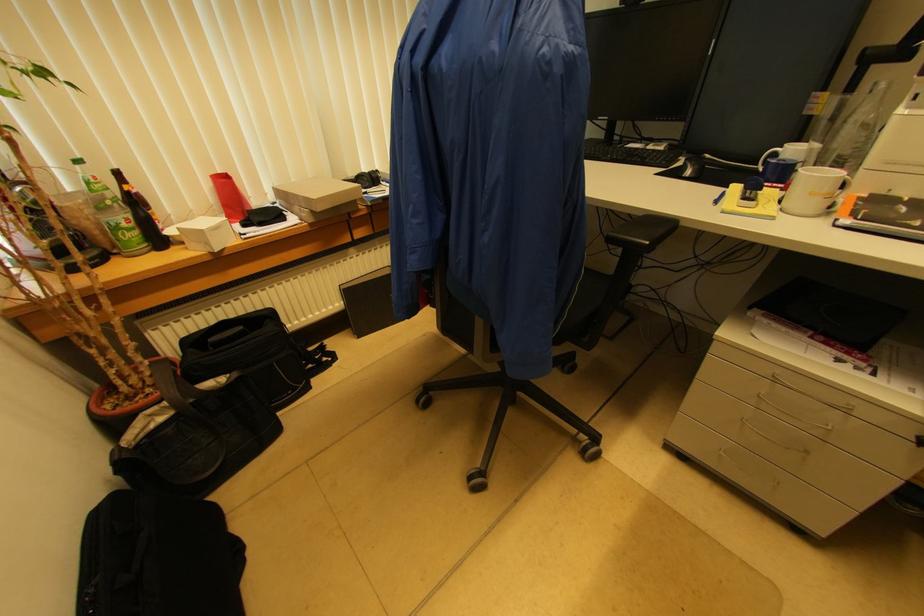
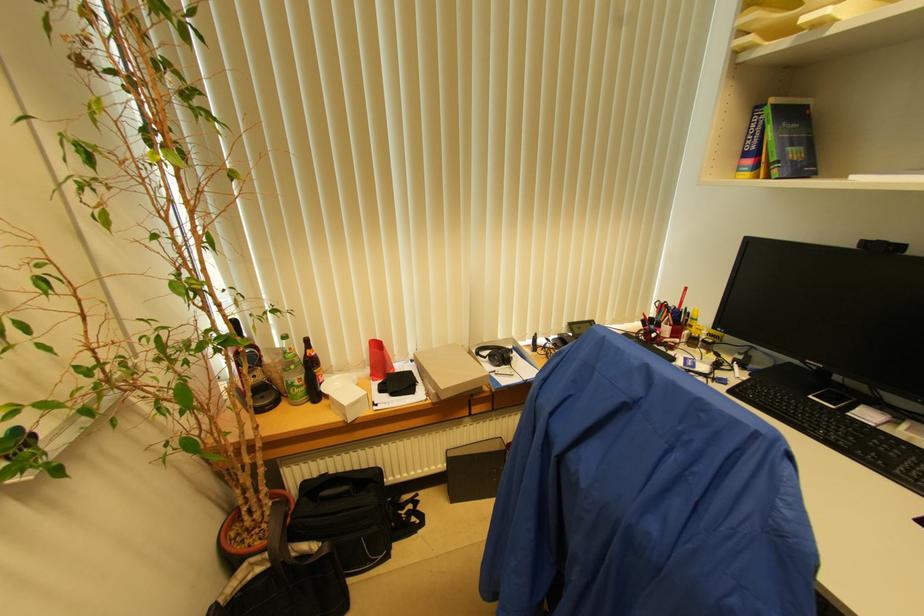
Where in the second image is the point corresponding to point (175, 408) from the first image?

(273, 561)